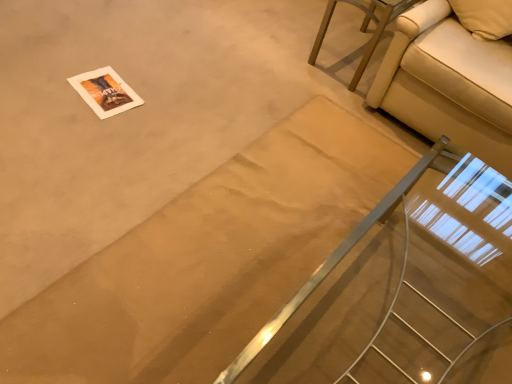
Question: Looking at their shapes, would you say clear glass stairs at center is wider or thinner than beige fabric couch at upper right?

Choices:
 (A) wide
 (B) thin

Answer: (B)

Question: Is clear glass stairs at center spatially inside beige fabric couch at upper right, or outside of it?

Choices:
 (A) inside
 (B) outside

Answer: (B)

Question: Based on their relative distances, which object is nearer to the beige fabric couch at upper right?

Choices:
 (A) clear glass stairs at center
 (B) beige fabric couch at upper right

Answer: (A)

Question: Estimate the real-world distances between objects in this image. Which object is closer to the beige fabric couch at upper right?

Choices:
 (A) clear glass stairs at center
 (B) beige fabric couch at upper right

Answer: (B)